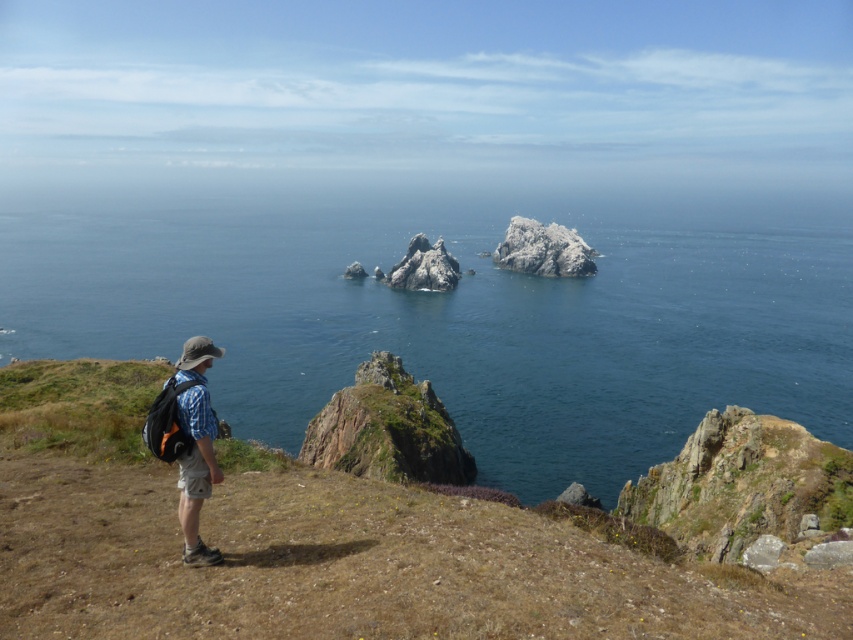
Question: Is plaid fabric shirt at lower left further to the viewer compared to white rocky island at center?

Choices:
 (A) no
 (B) yes

Answer: (A)

Question: Is brown grassy hillside at lower left bigger than white rocky island at center?

Choices:
 (A) no
 (B) yes

Answer: (A)

Question: Which point appears farthest from the camera in this image?

Choices:
 (A) 608,312
 (B) 511,570

Answer: (A)

Question: Which point is closer to the camera?

Choices:
 (A) (183, 480)
 (B) (422, 236)
 (C) (578, 244)

Answer: (A)

Question: Which point is farther to the camera?

Choices:
 (A) white rocky island at center
 (B) rugged stone rock formation at center
 (C) brown grassy hillside at lower left
 (D) plaid fabric shirt at lower left

Answer: (A)

Question: Is blue water at center smaller than rugged stone rock formation at center?

Choices:
 (A) no
 (B) yes

Answer: (A)